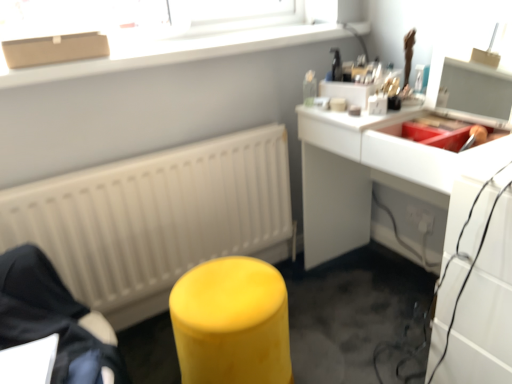
Find the location of a particular element. The width and height of the screenshot is (512, 384). free region under white glossy desk at upper right (from a real-world perspective) is located at coordinates (381, 293).